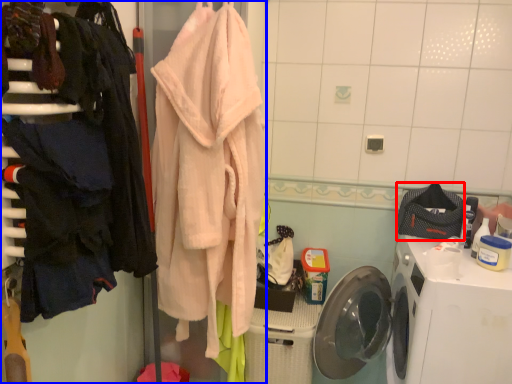
Question: Which point is further to the camera, clothing (highlighted by a red box) or closet (highlighted by a blue box)?

Choices:
 (A) clothing
 (B) closet

Answer: (A)